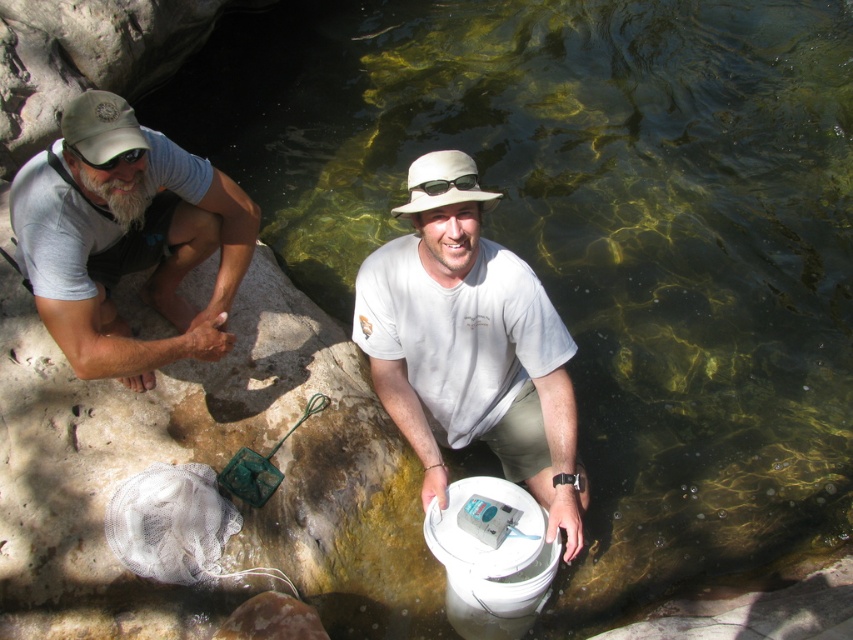
Question: Which point is closer to the camera taking this photo?

Choices:
 (A) (166, 314)
 (B) (432, 355)

Answer: (B)

Question: Is white matte shirt at center to the left of matte gray shirt at left from the viewer's perspective?

Choices:
 (A) no
 (B) yes

Answer: (A)

Question: Can you confirm if white matte shirt at center is positioned to the right of matte gray shirt at left?

Choices:
 (A) yes
 (B) no

Answer: (A)

Question: Which point is farther to the camera?

Choices:
 (A) white matte shirt at center
 (B) matte gray shirt at left

Answer: (A)

Question: Is white matte shirt at center thinner than matte gray shirt at left?

Choices:
 (A) yes
 (B) no

Answer: (B)

Question: Which point is farther from the camera taking this photo?

Choices:
 (A) (82, 221)
 (B) (492, 426)

Answer: (B)